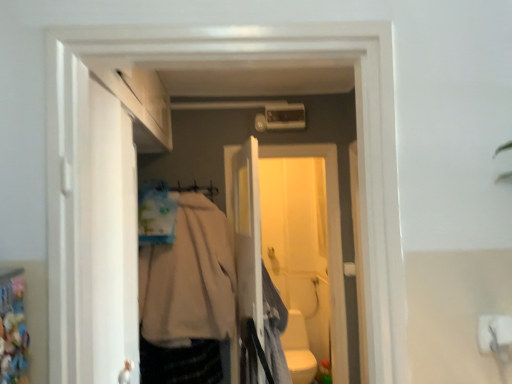
I want to click on vacant point above beige fabric hanger at center (from a real-world perspective), so click(x=178, y=182).